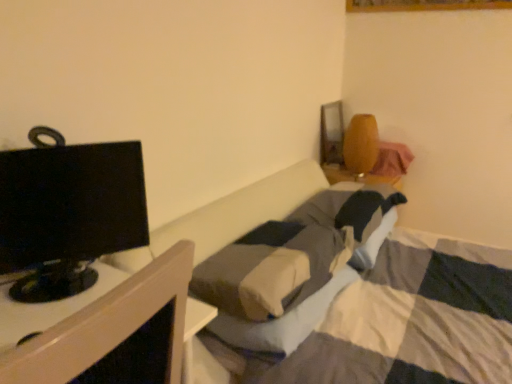
Image resolution: width=512 pixels, height=384 pixels. I want to click on vacant space in black glossy monitor at left (from a real-world perspective), so (x=80, y=288).